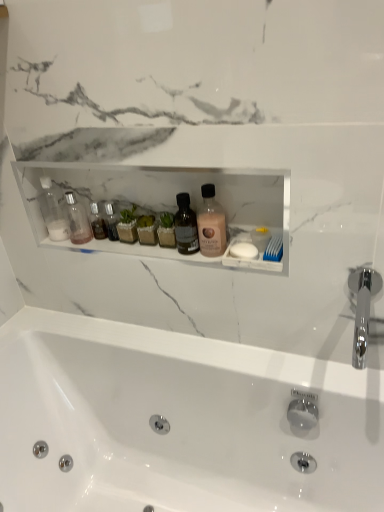
The width and height of the screenshot is (384, 512). What do you see at coordinates (244, 250) in the screenshot? I see `white matte soap at right` at bounding box center [244, 250].

This screenshot has height=512, width=384. Describe the element at coordinates (362, 309) in the screenshot. I see `chrome metallic faucet at right` at that location.

Image resolution: width=384 pixels, height=512 pixels. Describe the element at coordinates (211, 224) in the screenshot. I see `pink matte lotion at center` at that location.

Measure the distance between pink matte lotion at center and camera.

They are 39.15 inches apart.

Where is `white matte soap at right`? white matte soap at right is located at coordinates (244, 250).

Considering the sizes of objects chrome metallic faucet at right and white glossy bathtub at center in the image provided, who is taller, chrome metallic faucet at right or white glossy bathtub at center?

With more height is white glossy bathtub at center.

Is chrome metallic faucet at right far from white glossy bathtub at center?

No, chrome metallic faucet at right is not far from white glossy bathtub at center.

Is chrome metallic faucet at right thinner than white glossy bathtub at center?

Yes.

Is white glossy bathtub at center oriented away from clear glass bottle at left, the 2th toiletry when ordered from left to right?

No, white glossy bathtub at center is not facing the opposite direction of clear glass bottle at left, the 2th toiletry when ordered from left to right.

Who is taller, white glossy bathtub at center or clear glass bottle at left, the 2th toiletry when ordered from left to right?

white glossy bathtub at center is taller.

Is white glossy bathtub at center with clear glass bottle at left, arranged as the 1th toiletry when viewed from the right?

No, white glossy bathtub at center is not making contact with clear glass bottle at left, arranged as the 1th toiletry when viewed from the right.

Considering the sizes of objects white glossy bathtub at center and clear glass bottle at left, arranged as the 1th toiletry when viewed from the right, in the image provided, who is wider, white glossy bathtub at center or clear glass bottle at left, arranged as the 1th toiletry when viewed from the right,?

white glossy bathtub at center is wider.

Considering the sizes of objects clear glass bottle at left, the 2th toiletry when ordered from left to right, and chrome metallic faucet at right in the image provided, who is smaller, clear glass bottle at left, the 2th toiletry when ordered from left to right, or chrome metallic faucet at right?

With smaller size is clear glass bottle at left, the 2th toiletry when ordered from left to right.

Locate an element on the screen. This screenshot has height=512, width=384. the 1st toiletry directly above the chrome metallic faucet at right (from a real-world perspective) is located at coordinates (77, 220).

Is clear glass bottle at left, arranged as the 1th toiletry when viewed from the right, behind chrome metallic faucet at right?

Yes, clear glass bottle at left, arranged as the 1th toiletry when viewed from the right, is further from the camera.

Between clear glass bottle at left, arranged as the 1th toiletry when viewed from the right, and chrome metallic faucet at right, which one has smaller width?

clear glass bottle at left, arranged as the 1th toiletry when viewed from the right.

Is transparent plastic bottle at left, which is the second toiletry in right-to-left order, far away from white matte soap at right?

No, transparent plastic bottle at left, which is the second toiletry in right-to-left order, is not far away from white matte soap at right.

Which object is further away from the camera taking this photo, transparent plastic bottle at left, positioned as the 1th toiletry in left-to-right order, or white matte soap at right?

Positioned behind is transparent plastic bottle at left, positioned as the 1th toiletry in left-to-right order.

Consider the image. Looking at the image, does transparent plastic bottle at left, positioned as the 1th toiletry in left-to-right order, seem bigger or smaller compared to white matte soap at right?

Clearly, transparent plastic bottle at left, positioned as the 1th toiletry in left-to-right order, is larger in size than white matte soap at right.

From a real-world perspective, is white glossy bathtub at center physically below white matte soap at right?

Indeed, from a real-world perspective, white glossy bathtub at center is positioned beneath white matte soap at right.

Is white glossy bathtub at center not near white matte soap at right?

No, white glossy bathtub at center is not far from white matte soap at right.

Relative to white matte soap at right, is white glossy bathtub at center in front or behind?

Clearly, white glossy bathtub at center is in front of white matte soap at right.

Is chrome metallic faucet at right at the back of white glossy bathtub at center?

No, white glossy bathtub at center's orientation is not away from chrome metallic faucet at right.

Is white glossy bathtub at center outside of chrome metallic faucet at right?

Indeed, white glossy bathtub at center is completely outside chrome metallic faucet at right.

Considering their positions, is white glossy bathtub at center located in front of or behind chrome metallic faucet at right?

In the image, white glossy bathtub at center appears in front of chrome metallic faucet at right.

In the scene shown: From a real-world perspective, which is physically below, transparent plastic bottle at left, which is the second toiletry in right-to-left order, or white glossy bathtub at center?

From a 3D spatial view, white glossy bathtub at center is below.

Are transparent plastic bottle at left, positioned as the 1th toiletry in left-to-right order, and white glossy bathtub at center making contact?

transparent plastic bottle at left, positioned as the 1th toiletry in left-to-right order, and white glossy bathtub at center are not in contact.

Can you confirm if transparent plastic bottle at left, which is the second toiletry in right-to-left order, is thinner than white glossy bathtub at center?

Correct, the width of transparent plastic bottle at left, which is the second toiletry in right-to-left order, is less than that of white glossy bathtub at center.

Image resolution: width=384 pixels, height=512 pixels. Find the location of `bathtub on the left of chrome metallic faucet at right`. bathtub on the left of chrome metallic faucet at right is located at coordinates (177, 421).

In the image, there is a clear glass bottle at left, arranged as the 1th toiletry when viewed from the right. Where is `bathtub below it (from the image's perspective)`? bathtub below it (from the image's perspective) is located at coordinates (177, 421).

From the image, which object appears to be farther from white matte soap at right, transparent plastic bottle at left, positioned as the 1th toiletry in left-to-right order, or clear glass bottle at left, arranged as the 1th toiletry when viewed from the right?

transparent plastic bottle at left, positioned as the 1th toiletry in left-to-right order, is further to white matte soap at right.

Looking at the image, which one is located further to white matte soap at right, transparent plastic bottle at left, positioned as the 1th toiletry in left-to-right order, or white glossy bathtub at center?

The object further to white matte soap at right is white glossy bathtub at center.

Looking at the image, which one is located further to clear glass bottle at left, the 2th toiletry when ordered from left to right, white glossy bathtub at center or transparent plastic bottle at left, which is the second toiletry in right-to-left order?

white glossy bathtub at center is positioned further to the anchor clear glass bottle at left, the 2th toiletry when ordered from left to right.

Estimate the real-world distances between objects in this image. Which object is closer to transparent plastic bottle at left, which is the second toiletry in right-to-left order, chrome metallic faucet at right or white glossy bathtub at center?

white glossy bathtub at center.

Estimate the real-world distances between objects in this image. Which object is further from pink matte lotion at center, white matte soap at right or clear glass bottle at left, the 2th toiletry when ordered from left to right?

clear glass bottle at left, the 2th toiletry when ordered from left to right, is positioned further to the anchor pink matte lotion at center.

Based on their spatial positions, is chrome metallic faucet at right or white matte soap at right further from clear glass bottle at left, arranged as the 1th toiletry when viewed from the right?

chrome metallic faucet at right.

Estimate the real-world distances between objects in this image. Which object is closer to white matte soap at right, clear glass bottle at left, the 2th toiletry when ordered from left to right, or transparent plastic bottle at left, positioned as the 1th toiletry in left-to-right order?

Based on the image, clear glass bottle at left, the 2th toiletry when ordered from left to right, appears to be nearer to white matte soap at right.

Estimate the real-world distances between objects in this image. Which object is further from chrome metallic faucet at right, clear glass bottle at left, the 2th toiletry when ordered from left to right, or pink matte lotion at center?

clear glass bottle at left, the 2th toiletry when ordered from left to right, is positioned further to the anchor chrome metallic faucet at right.

The height and width of the screenshot is (512, 384). I want to click on soap situated between clear glass bottle at left, arranged as the 1th toiletry when viewed from the right, and chrome metallic faucet at right from left to right, so click(244, 250).

Locate an element on the screen. cleaning product situated between transparent plastic bottle at left, which is the second toiletry in right-to-left order, and white matte soap at right from left to right is located at coordinates (211, 224).

This screenshot has width=384, height=512. I want to click on cleaning product between clear glass bottle at left, arranged as the 1th toiletry when viewed from the right, and chrome metallic faucet at right, in the horizontal direction, so click(211, 224).

Where is `toiletry between transparent plastic bottle at left, positioned as the 1th toiletry in left-to-right order, and white glossy bathtub at center, in the vertical direction`? The image size is (384, 512). toiletry between transparent plastic bottle at left, positioned as the 1th toiletry in left-to-right order, and white glossy bathtub at center, in the vertical direction is located at coordinates (77, 220).